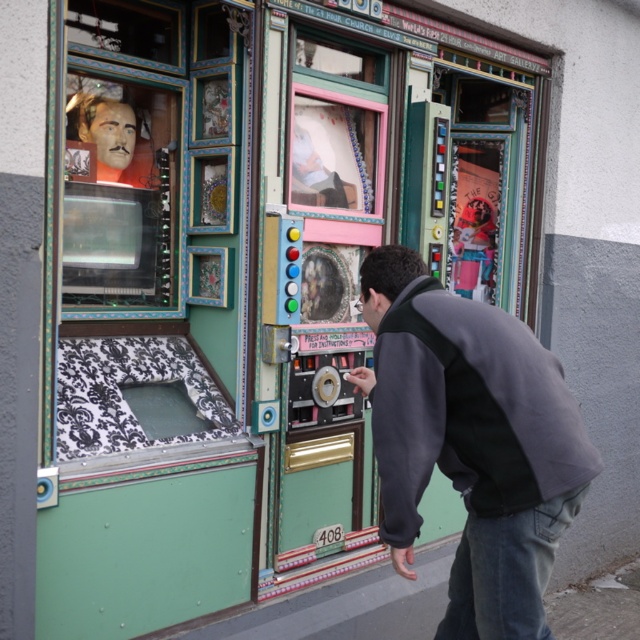
You are a customer standing in front of the claw machine. You notice two items on the ground near the machine. One is a dark gray fleece at center, and the other is denim at lower right. Which item is closer to the claw machine?

The dark gray fleece at center is closer to the claw machine because it is to the left of denim at lower right, which is further away.

You are a customer standing at the storefront and see the dark gray fleece at center and denim at lower right. Which object is taller?

The dark gray fleece at center is taller than denim at lower right.

You are a delivery person standing in front of the storefront. You need to place a package on the ground near the dark gray fleece at center. If your reach extends 1.8 meters, can you place the package without moving closer?

The dark gray fleece at center is 2.32 meters away from the viewer. Since your reach extends only 1.8 meters, you cannot place the package without moving closer.